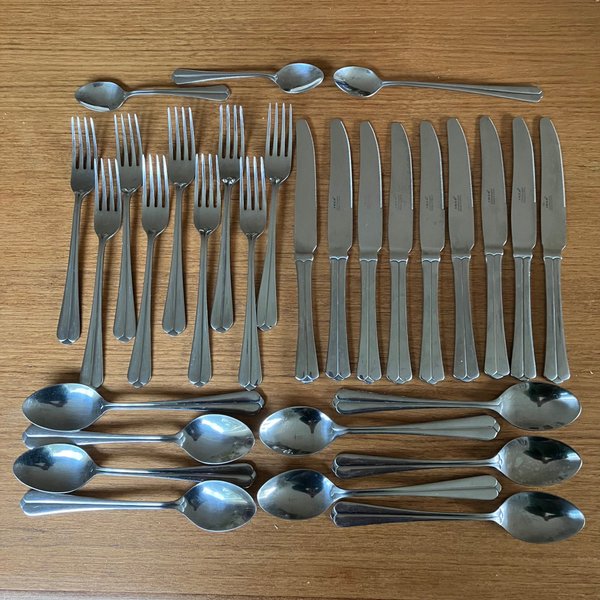
This screenshot has width=600, height=600. I want to click on forks, so click(x=84, y=162), click(x=108, y=207), click(x=136, y=168), click(x=153, y=195), click(x=177, y=164), click(x=205, y=205), click(x=231, y=166), click(x=251, y=210), click(x=278, y=151).